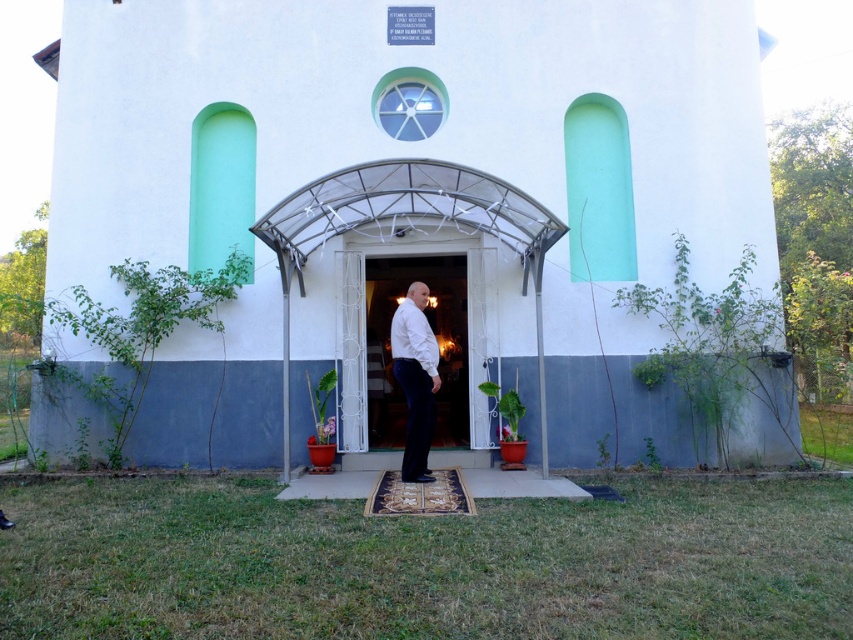
You are a visitor arriving at the white matte chapel at center and the white wooden door at center. You want to enter the building. Which object should you approach to enter?

The white wooden door at center is the entrance, so you should approach the white wooden door at center to enter the building.

You are standing at the point with coordinates point (x=409, y=193). What structure are you at the center of?

The point (x=409, y=193) corresponds to the white matte chapel at center, so you are at the center of the white matte chapel at center.

You are standing at the point labeled point (459, 292) and want to take a photo of the building entrance. The camera you have can only focus on objects within 10 meters. Will the entrance be in focus?

The point labeled point (459, 292) and the camera are 11.40 meters apart, which is beyond the camera focus range of 10 meters. Therefore, the entrance will not be in focus.